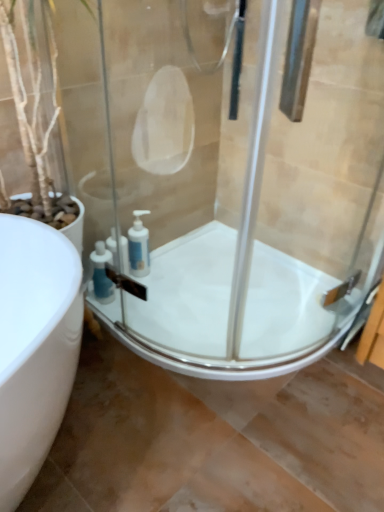
Where is `vacant area that is situated to the right of blue plastic soap dispenser at lower center, the 1th soap dispenser in the left-to-right sequence`? The height and width of the screenshot is (512, 384). vacant area that is situated to the right of blue plastic soap dispenser at lower center, the 1th soap dispenser in the left-to-right sequence is located at coordinates (148, 306).